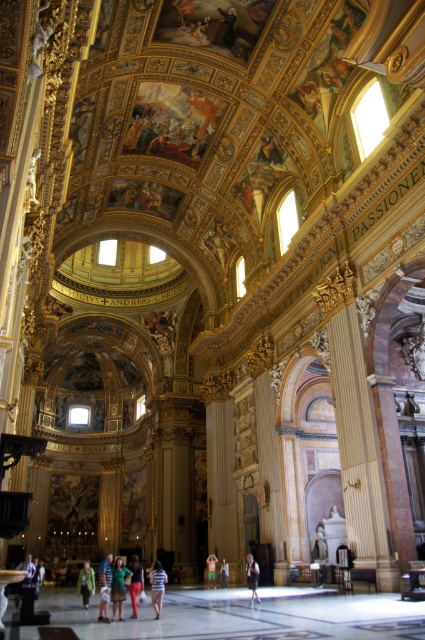
Question: Is green fabric dress at center thinner than orange cotton shirt at center?

Choices:
 (A) no
 (B) yes

Answer: (A)

Question: Is green fabric dress at center to the left of green fabric shirt at center from the viewer's perspective?

Choices:
 (A) yes
 (B) no

Answer: (A)

Question: Which is farther from the green fabric shirt at center?

Choices:
 (A) light brown leather jacket at center
 (B) light blue denim jeans at center

Answer: (B)

Question: Which of the following is the farthest from the observer?

Choices:
 (A) (246, 566)
 (B) (136, 588)
 (C) (155, 605)
 (D) (102, 561)

Answer: (D)

Question: Which object is farther from the camera taking this photo?

Choices:
 (A) green fabric shirt at center
 (B) orange cotton shirt at center
 (C) white cotton shirt at lower left

Answer: (B)

Question: Is light brown leather jacket at center thinner than orange cotton shirt at center?

Choices:
 (A) yes
 (B) no

Answer: (B)